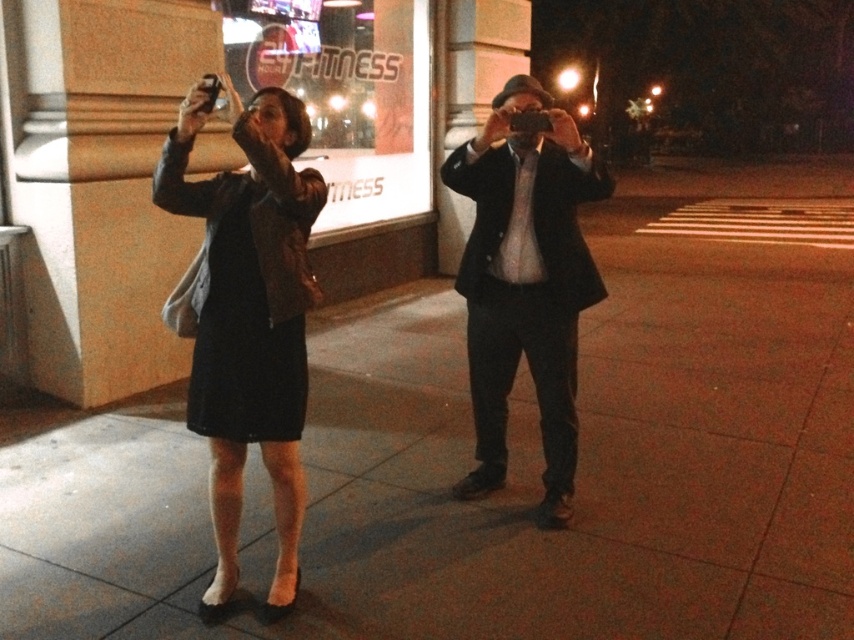
Question: Can you confirm if leather jacket at left is smaller than dark suit at center?

Choices:
 (A) yes
 (B) no

Answer: (A)

Question: Considering the relative positions of leather jacket at left and dark suit at center in the image provided, where is leather jacket at left located with respect to dark suit at center?

Choices:
 (A) right
 (B) left

Answer: (B)

Question: Does leather jacket at left appear on the right side of dark suit at center?

Choices:
 (A) no
 (B) yes

Answer: (A)

Question: Which object appears closest to the camera in this image?

Choices:
 (A) leather jacket at left
 (B) dark suit at center

Answer: (A)

Question: Which object appears farthest from the camera in this image?

Choices:
 (A) leather jacket at left
 (B) dark suit at center

Answer: (B)

Question: Which point appears farthest from the camera in this image?

Choices:
 (A) (458, 186)
 (B) (202, 92)

Answer: (A)